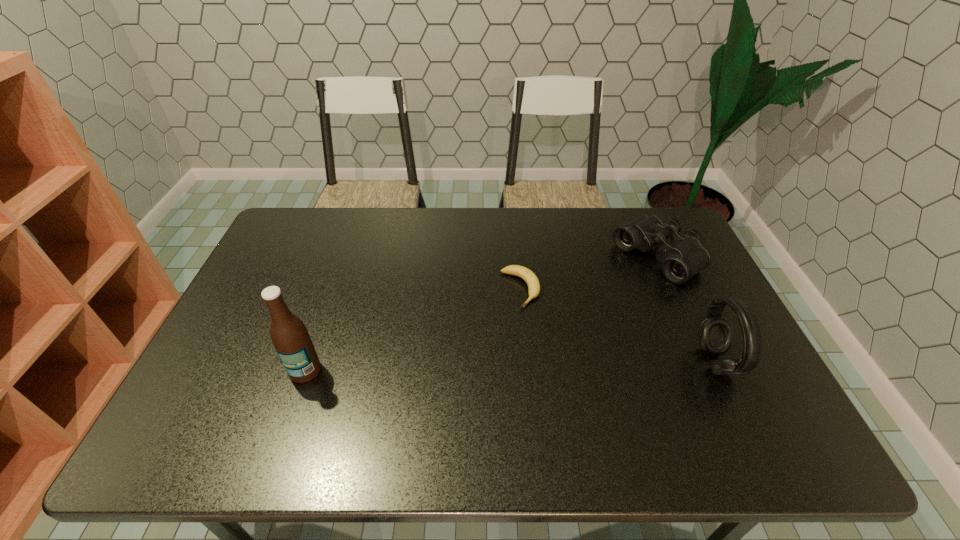
You are a GUI agent. You are given a task and a screenshot of the screen. Output one action in this format:
    pyautogui.click(x=<x>, y=<y>)
    Task: Click on the free space on the desktop that is between the beer bottle and the headset and is positioned at the stem of the second object from left to right
    
    Given the screenshot: What is the action you would take?
    (x=573, y=364)

The image size is (960, 540). In order to click on free space on the desktop that is between the tallest object and the third shortest object and is positioned at the eyepieces of the second shortest object in this screenshot , I will do `click(484, 367)`.